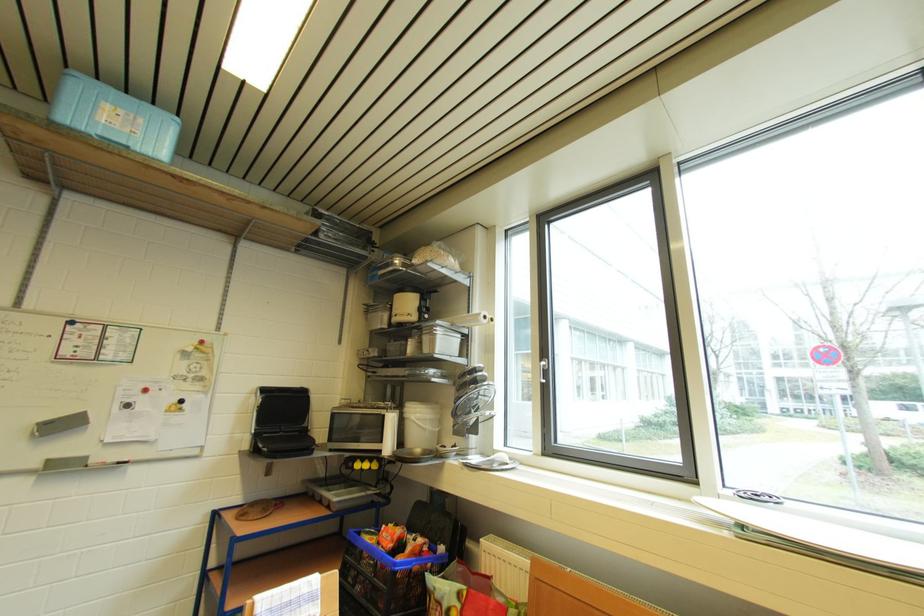
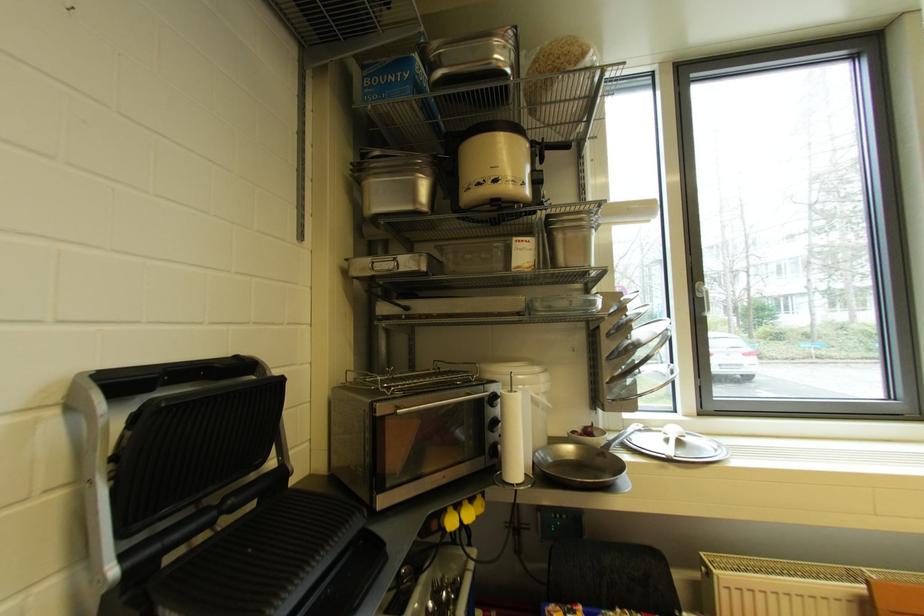
Find the pixel in the second image that matches point 386,330 in the first image.

(418, 211)